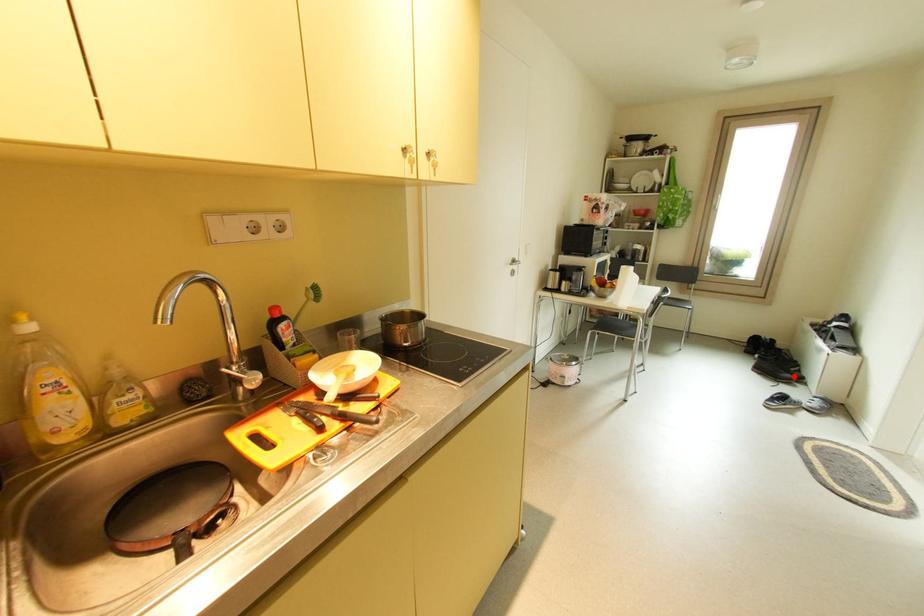
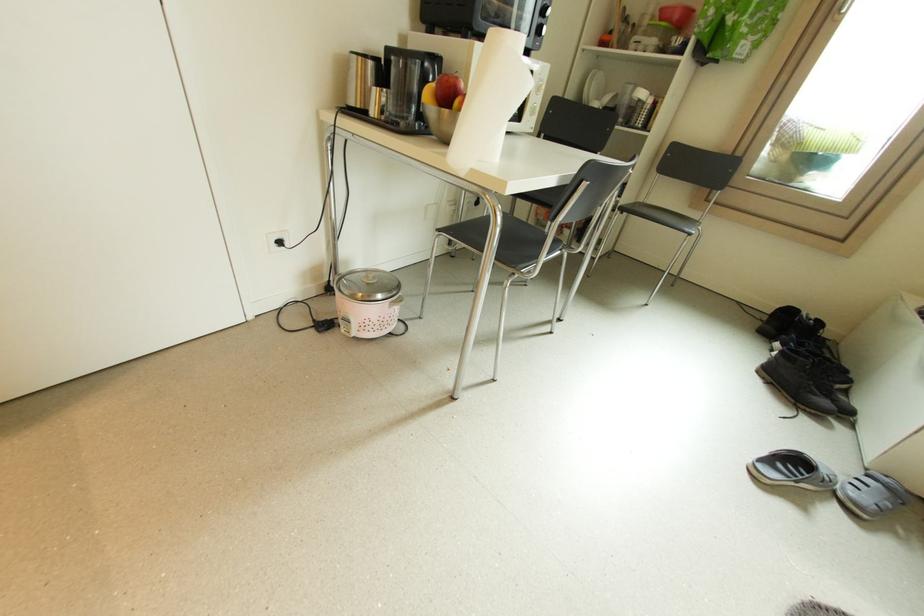
The point at the highlighted location is marked in the first image. Where is the corresponding point in the second image?

(830, 403)